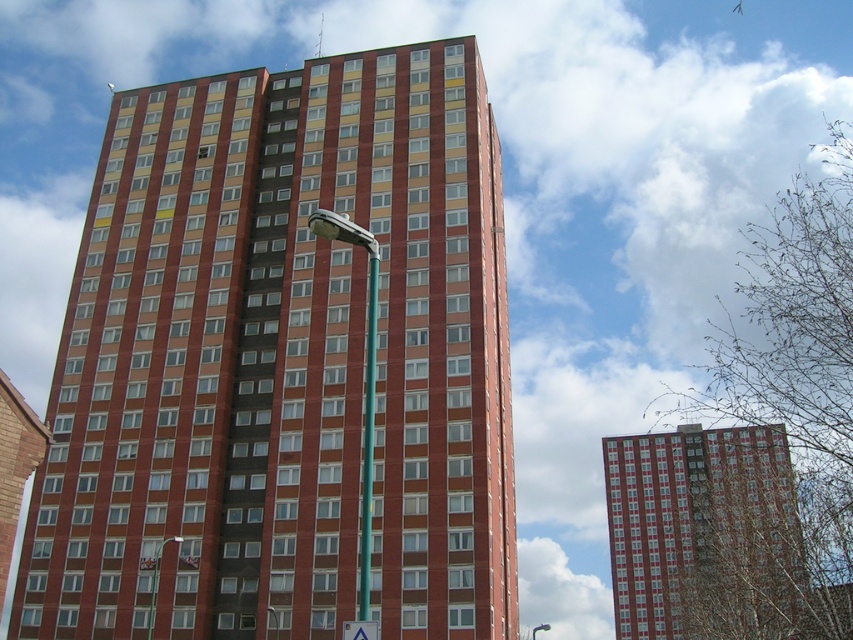
Does red brick building at center appear under white plastic triangle at center?

Correct, red brick building at center is located below white plastic triangle at center.

Does red brick building at center have a larger size compared to white plastic triangle at center?

Yes, red brick building at center is bigger than white plastic triangle at center.

Is point (766, 499) closer to viewer compared to point (350, 637)?

No, it is behind (350, 637).

Identify the location of red brick building at center. (703, 532).

Who is shorter, brick textured building at center or teal glossy pole at center?

Standing shorter between the two is teal glossy pole at center.

Is point (349, 204) positioned after point (370, 518)?

Yes, point (349, 204) is farther from viewer.

Between point (27, 531) and point (363, 429), which one is positioned in front?

Point (363, 429) is more forward.

The image size is (853, 640). In order to click on brick textured building at center in this screenshot , I will do `click(283, 364)`.

Is brick textured building at center shorter than red brick building at center?

Yes, brick textured building at center is shorter than red brick building at center.

Is point (80, 396) behind point (752, 451)?

That is False.

This screenshot has height=640, width=853. In order to click on brick textured building at center in this screenshot , I will do pyautogui.click(x=283, y=364).